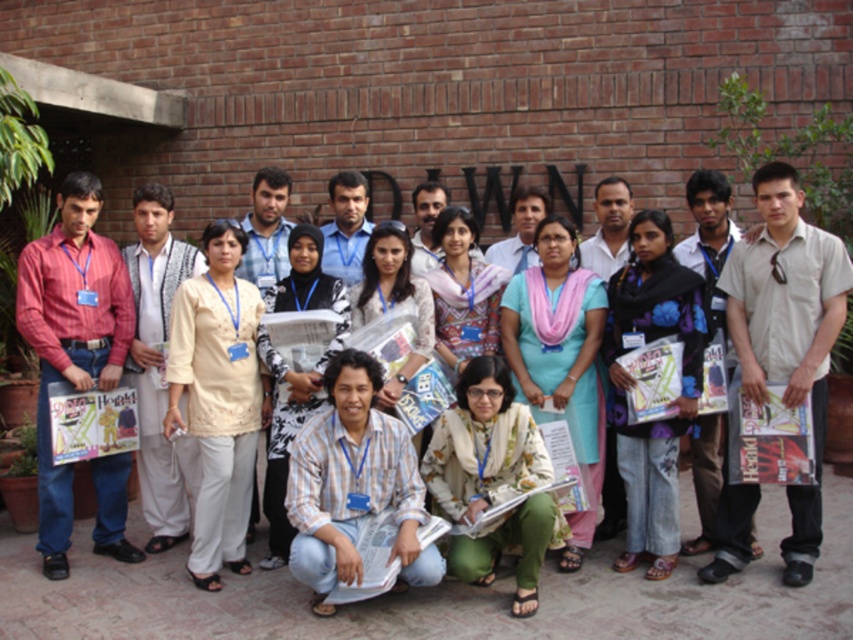
Who is higher up, light brown striped shirt at lower center or floral fabric scarf at center?

Positioned higher is light brown striped shirt at lower center.

Which of these two, light brown striped shirt at lower center or floral fabric scarf at center, stands taller?

light brown striped shirt at lower center

This screenshot has height=640, width=853. What are the coordinates of `light brown striped shirt at lower center` in the screenshot? It's located at (352, 484).

Looking at this image, is light beige shirt at center below pink floral scarf at center?

Yes.

Identify the location of light beige shirt at center. The height and width of the screenshot is (640, 853). (788, 330).

Locate an element on the screen. light beige shirt at center is located at coordinates (788, 330).

Is light beige shirt at center to the left of beige embroidered kurta at center from the viewer's perspective?

No, light beige shirt at center is not to the left of beige embroidered kurta at center.

Does light beige shirt at center have a larger size compared to beige embroidered kurta at center?

Yes, light beige shirt at center is bigger than beige embroidered kurta at center.

Is point (730, 524) positioned behind point (213, 420)?

No, it is not.

Image resolution: width=853 pixels, height=640 pixels. In order to click on light beige shirt at center in this screenshot , I will do `click(788, 330)`.